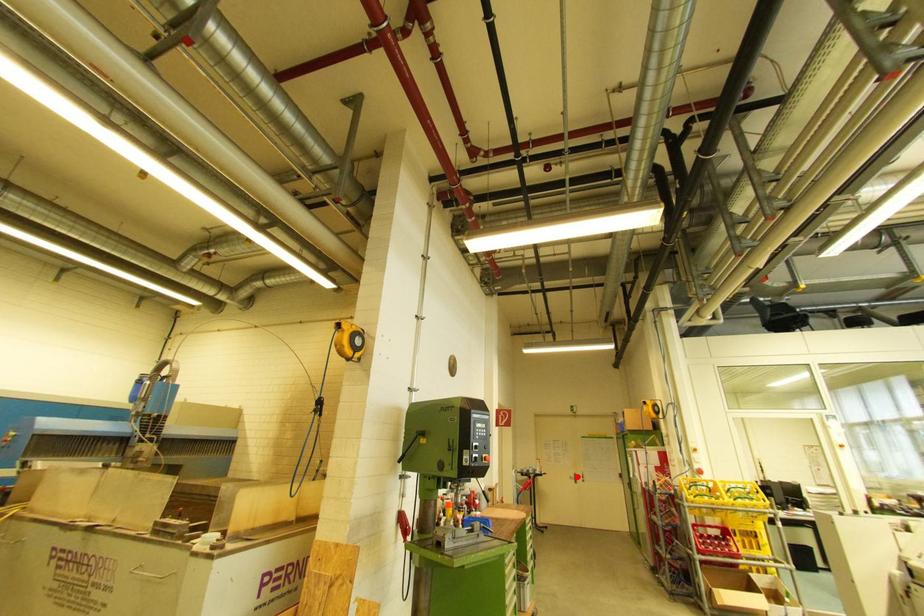
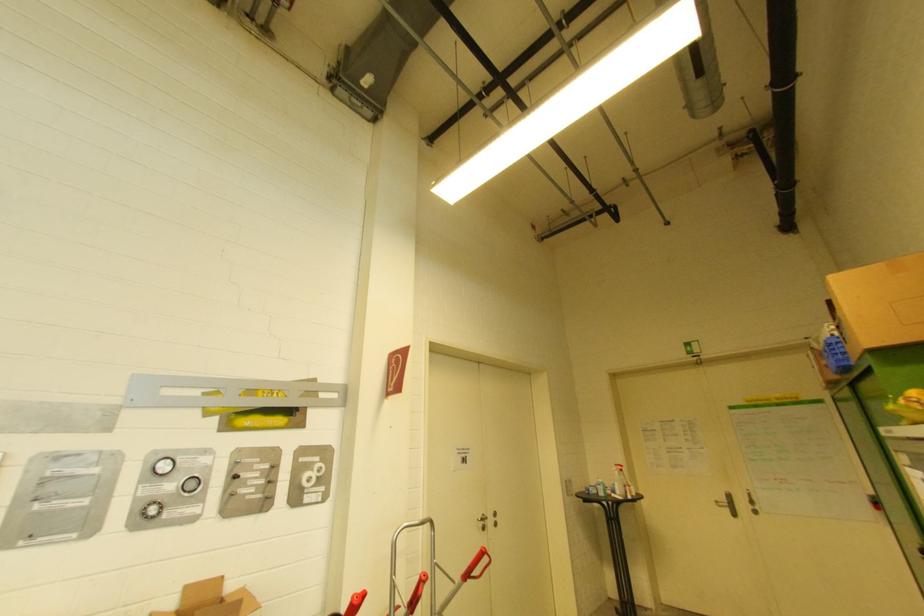
The point at the highlighted location is marked in the first image. Where is the corresponding point in the second image?

(731, 498)